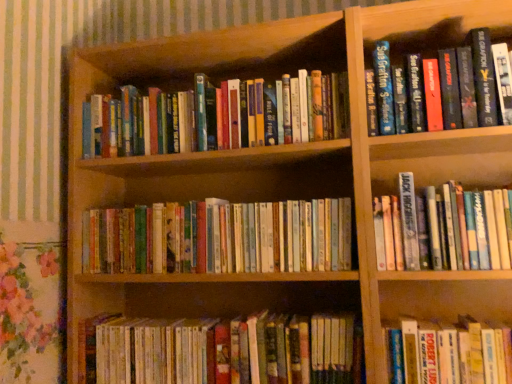
Question: In which direction should I rotate to look at hardcover books at lower center, which is counted as the 1th book, starting from the bottom?

Choices:
 (A) right
 (B) left

Answer: (B)

Question: Is the position of hardcover book at lower right, which is counted as the fifth book, starting from the top, less distant than that of hardcover books at center, placed as the fourth book when sorted from top to bottom?

Choices:
 (A) yes
 (B) no

Answer: (A)

Question: Can you confirm if hardcover book at lower right, which is counted as the fifth book, starting from the top, is thinner than hardcover books at center, placed as the fourth book when sorted from top to bottom?

Choices:
 (A) no
 (B) yes

Answer: (A)

Question: Can you confirm if hardcover book at lower right, the 2th book in the bottom-to-top sequence, is shorter than hardcover books at center, placed as the fourth book when sorted from top to bottom?

Choices:
 (A) yes
 (B) no

Answer: (B)

Question: Is hardcover book at lower right, which is counted as the fifth book, starting from the top, in contact with hardcover books at center, placed as the fourth book when sorted from top to bottom?

Choices:
 (A) yes
 (B) no

Answer: (B)

Question: Is hardcover book at lower right, the 2th book in the bottom-to-top sequence, smaller than hardcover books at center, placed as the fourth book when sorted from top to bottom?

Choices:
 (A) yes
 (B) no

Answer: (A)

Question: Is hardcover book at lower right, the 2th book in the bottom-to-top sequence, far away from hardcover books at center, the third book positioned from the bottom?

Choices:
 (A) yes
 (B) no

Answer: (B)

Question: Does hardcover book at upper right, the 1th book when ordered from top to bottom, lie behind white paperback book at right, the 4th book positioned from the bottom?

Choices:
 (A) yes
 (B) no

Answer: (A)

Question: Is hardcover book at upper right, positioned as the sixth book in bottom-to-top order, not inside white paperback book at right, arranged as the third book when viewed from the top?

Choices:
 (A) no
 (B) yes

Answer: (B)

Question: Can you confirm if hardcover book at upper right, the 1th book when ordered from top to bottom, is thinner than white paperback book at right, the 4th book positioned from the bottom?

Choices:
 (A) no
 (B) yes

Answer: (A)

Question: Does hardcover book at upper right, positioned as the sixth book in bottom-to-top order, have a smaller size compared to white paperback book at right, the 4th book positioned from the bottom?

Choices:
 (A) yes
 (B) no

Answer: (B)

Question: From the image's perspective, would you say hardcover book at upper right, the 1th book when ordered from top to bottom, is positioned over white paperback book at right, arranged as the third book when viewed from the top?

Choices:
 (A) yes
 (B) no

Answer: (A)

Question: Does hardcover book at upper right, the 1th book when ordered from top to bottom, have a greater width compared to white paperback book at right, the 4th book positioned from the bottom?

Choices:
 (A) yes
 (B) no

Answer: (A)

Question: From the image's perspective, is hardcover book at upper right, positioned as the sixth book in bottom-to-top order, located above hardcover book at lower right, which is counted as the fifth book, starting from the top?

Choices:
 (A) yes
 (B) no

Answer: (A)